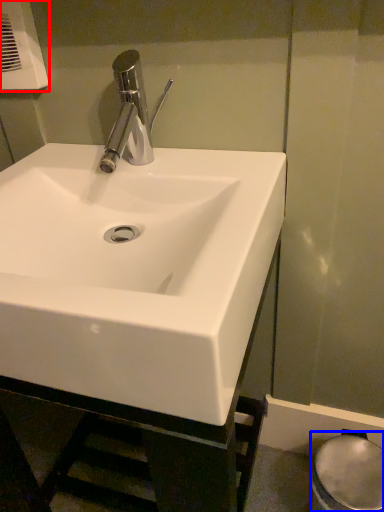
Question: Which of the following is the farthest to the observer, hand dryer (highlighted by a red box) or bidet (highlighted by a blue box)?

Choices:
 (A) hand dryer
 (B) bidet

Answer: (B)